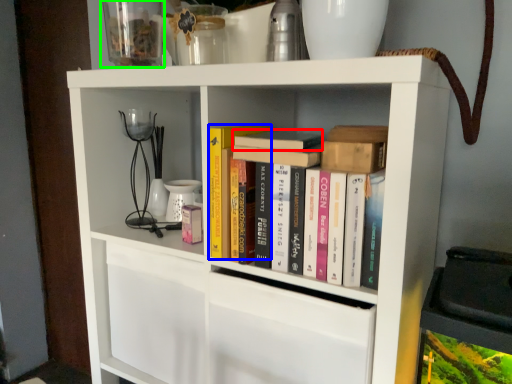
Question: Which is farther away from book (highlighted by a red box)? paperback book (highlighted by a blue box) or glass vase (highlighted by a green box)?

Choices:
 (A) paperback book
 (B) glass vase

Answer: (B)